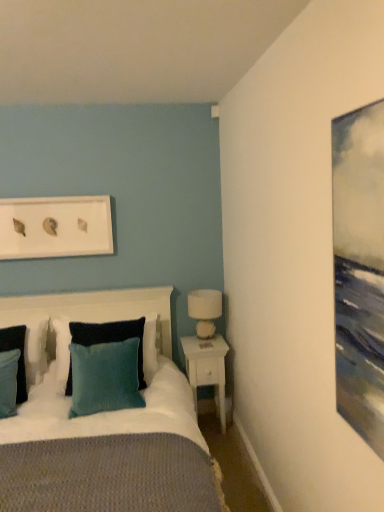
This screenshot has width=384, height=512. In order to click on vacant area on top of white matte picture frame at upper center (from a real-world perspective) in this screenshot , I will do `click(45, 195)`.